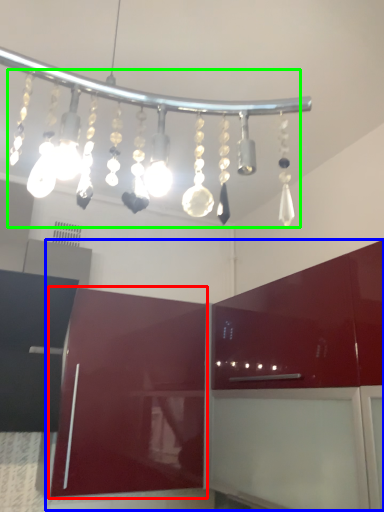
Question: Which is farther away from cabinetry (highlighted by a red box)? cabinetry (highlighted by a blue box) or chandelier (highlighted by a green box)?

Choices:
 (A) cabinetry
 (B) chandelier

Answer: (B)